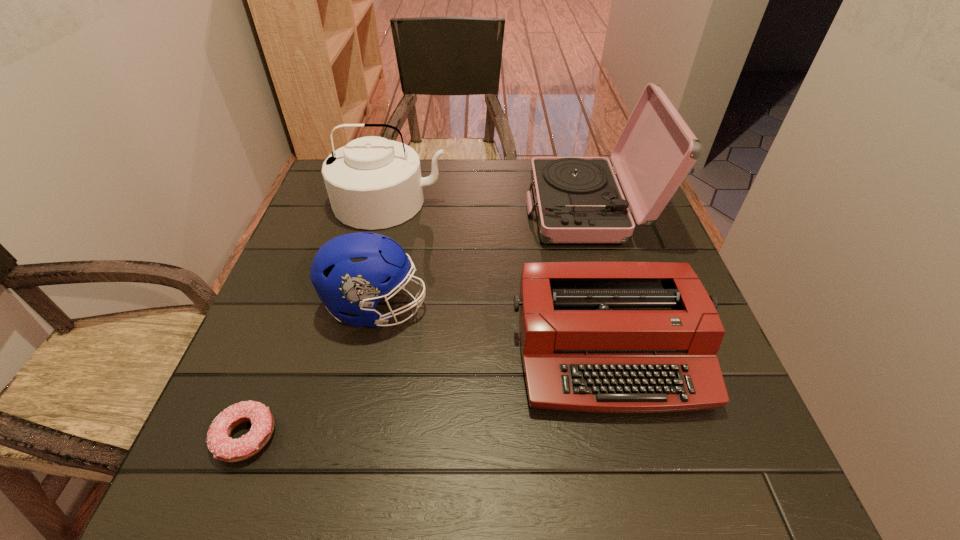
Where is `record player`? The height and width of the screenshot is (540, 960). record player is located at coordinates (578, 200).

This screenshot has width=960, height=540. I want to click on the second tallest object, so click(373, 183).

Where is `football helmet`? The image size is (960, 540). football helmet is located at coordinates (351, 273).

The height and width of the screenshot is (540, 960). Identify the location of the second shortest object. (607, 337).

Find the location of `doughnut`. doughnut is located at coordinates (224, 448).

You are a GUI agent. You are given a task and a screenshot of the screen. Output one action in this format:
    pyautogui.click(x=<x>, y=<y>)
    Task: Click on the free point located 0.250m with the lid open on the record player
    This screenshot has height=540, width=960.
    Given the screenshot: What is the action you would take?
    pyautogui.click(x=433, y=209)

Where is `free space located 0.250m with the lid open on the record player`? free space located 0.250m with the lid open on the record player is located at coordinates (x=433, y=209).

Locate an element on the screen. vacant space situated 0.360m with the lid open on the record player is located at coordinates (392, 209).

This screenshot has width=960, height=540. Find the location of `vacant space located on the spout of the kettle`. vacant space located on the spout of the kettle is located at coordinates (351, 361).

Where is `vacant point located on the face guard of the third tallest object`? vacant point located on the face guard of the third tallest object is located at coordinates (517, 307).